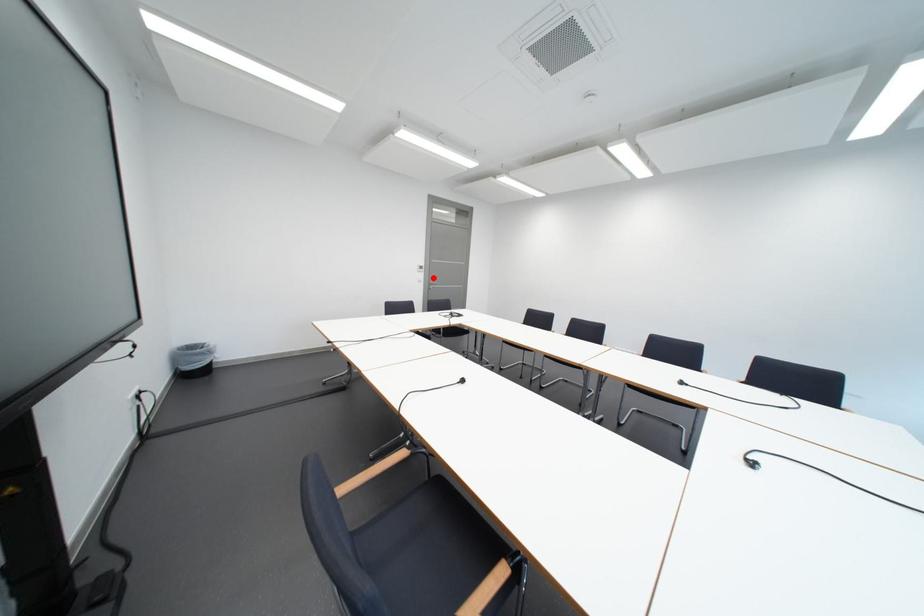
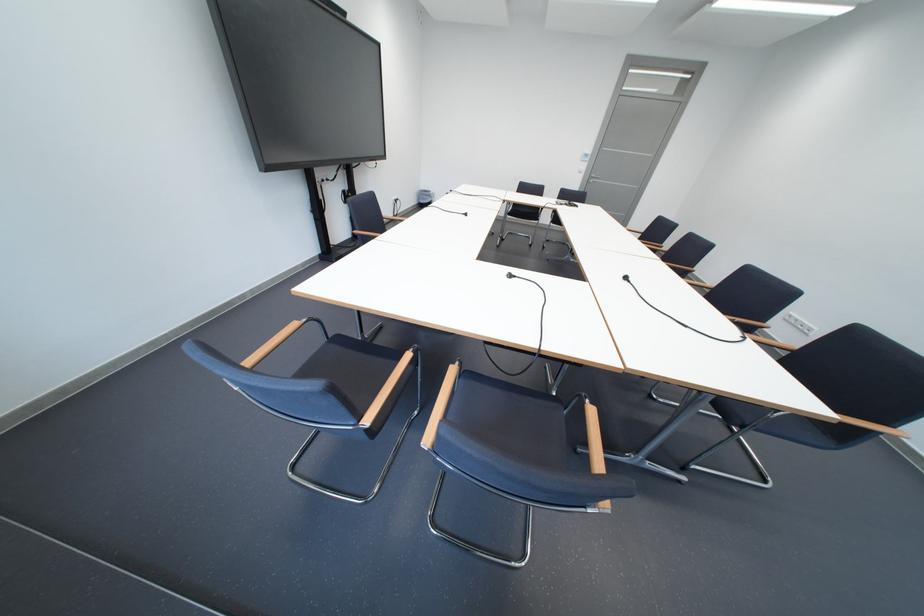
Where in the second image is the point corresponding to the highlighted location from the first image?

(596, 168)